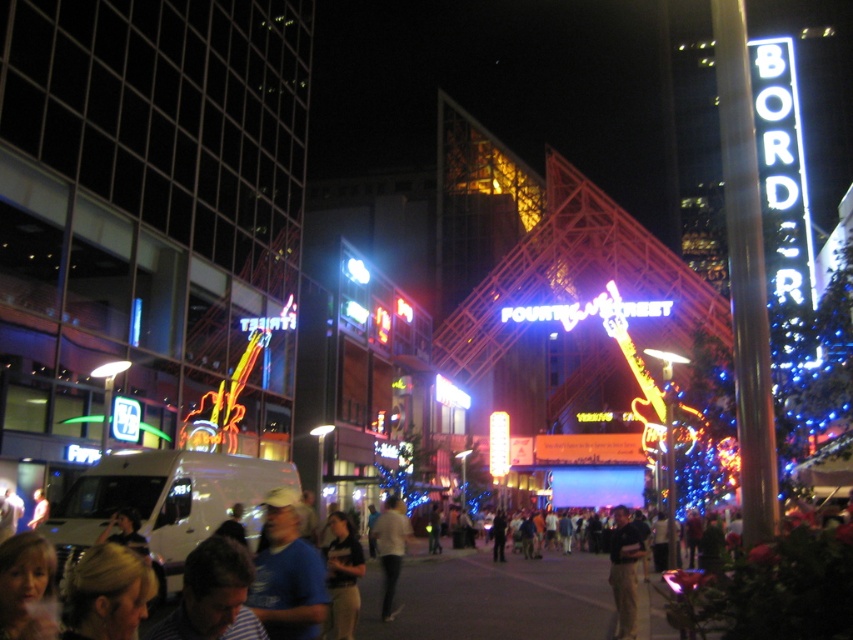
Question: Is dark blue shirt at center positioned in front of light beige pants at center?

Choices:
 (A) no
 (B) yes

Answer: (B)

Question: Which object is the closest to the dark blue shirt at center?

Choices:
 (A) blue matte shirt at lower center
 (B) light beige pants at center

Answer: (B)

Question: Which object appears farthest from the camera in this image?

Choices:
 (A) blue matte shirt at lower center
 (B) light beige pants at center

Answer: (B)

Question: Which point is farther to the camera?

Choices:
 (A) dark blue shirt at center
 (B) blue matte shirt at lower center

Answer: (A)

Question: Considering the relative positions of dark blue shirt at center and light beige pants at center in the image provided, where is dark blue shirt at center located with respect to light beige pants at center?

Choices:
 (A) above
 (B) below

Answer: (B)

Question: Can you confirm if blue matte shirt at lower center is smaller than dark blue shirt at center?

Choices:
 (A) yes
 (B) no

Answer: (A)